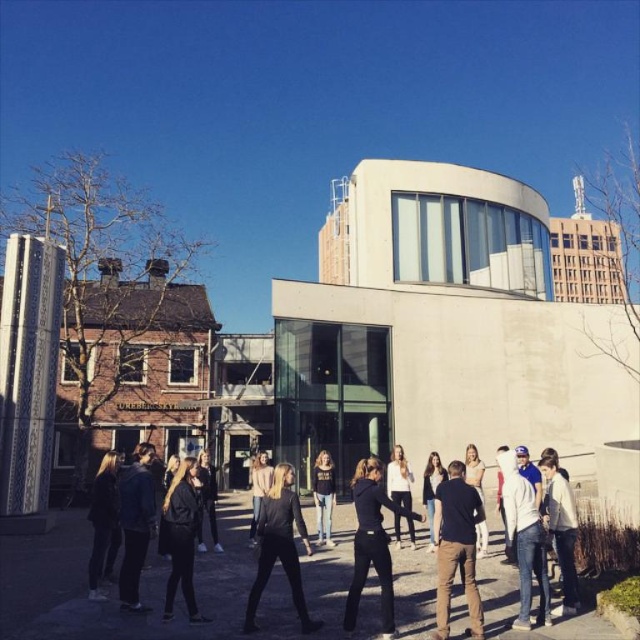
Based on the photo, you are a photographer standing at the edge of the group near the modern building. You want to take a photo of the black matte pants at center without any people blocking it. Can you move to the left or right to get a clear shot? Please explain based on their positions.

The black matte pants at center are located at point (371, 545). Since the group is standing in a semi circle facing towards the camera, moving to the left or right might allow you to position yourself where there are fewer people blocking the view. However, without knowing the exact positions of the people, it is uncertain if moving left or right would provide a clear shot. The photographer should check both directions to see which side has less obstruction.

You are standing in front of the modern building and want to place a small flag at the point closer to you between the two points marked as point (358,598) and point (410,531). Which point should you choose?

You should choose point (358,598) because it is closer to the viewer than point (410,531).

In the scene shown: You are a photographer trying to capture a group photo of the people in the scene. You notice the black matte jacket at center and the white matte shirt at center. Which clothing item will appear bigger in your photo?

The black matte jacket at center will appear bigger in the photo because it has a larger size compared to the white matte shirt at center.